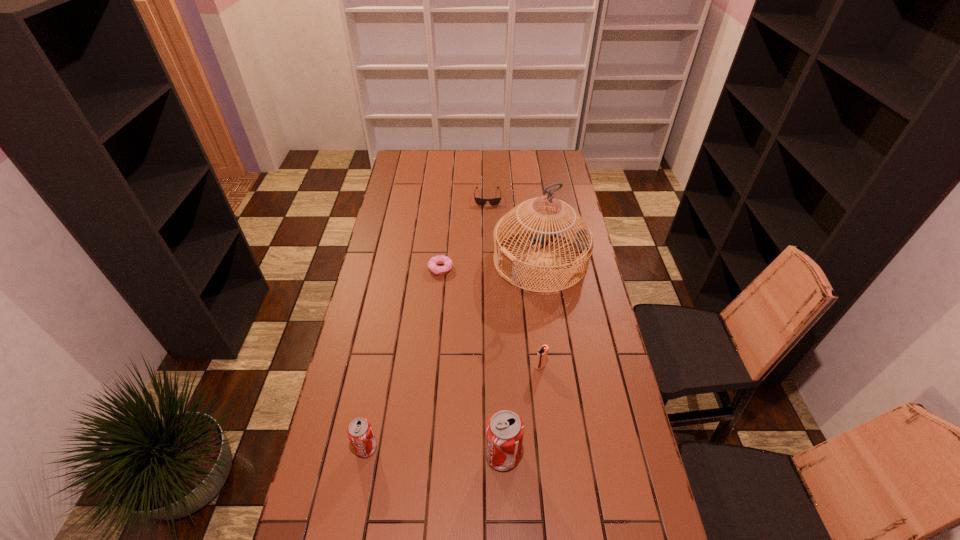
In the image, there is a desktop. At what (x,y) coordinates should I click in order to perform the action: click on vacant space at the right edge. Please return your answer as a coordinate pair (x, y). The height and width of the screenshot is (540, 960). Looking at the image, I should click on (588, 377).

Where is `free space at the far left corner of the desktop`? The width and height of the screenshot is (960, 540). free space at the far left corner of the desktop is located at coordinates (418, 165).

At what (x,y) coordinates should I click in order to perform the action: click on vacant area at the far right corner. Please return your answer as a coordinate pair (x, y). The height and width of the screenshot is (540, 960). Looking at the image, I should click on (543, 152).

Locate an element on the screen. free space at the near right corner of the desktop is located at coordinates (593, 526).

You are a GUI agent. You are given a task and a screenshot of the screen. Output one action in this format:
    pyautogui.click(x=<x>, y=<y>)
    Task: Click on the vacant area that lies between the second tallest object and the tallest object
    The height and width of the screenshot is (540, 960).
    Given the screenshot: What is the action you would take?
    pyautogui.click(x=521, y=357)

Where is `free space between the second tallest object and the farthest object`? free space between the second tallest object and the farthest object is located at coordinates (495, 326).

The image size is (960, 540). Find the location of `empty space that is in between the taller soda can and the fifth object from right to left`. empty space that is in between the taller soda can and the fifth object from right to left is located at coordinates (471, 362).

Where is `vacant space in between the fourth tallest object and the tallest object`? The height and width of the screenshot is (540, 960). vacant space in between the fourth tallest object and the tallest object is located at coordinates (540, 313).

Image resolution: width=960 pixels, height=540 pixels. Find the location of `vacant area that lies between the doughnut and the igniter`. vacant area that lies between the doughnut and the igniter is located at coordinates (491, 318).

Where is `unoccupied area between the doughnut and the leftmost object`? This screenshot has width=960, height=540. unoccupied area between the doughnut and the leftmost object is located at coordinates point(403,358).